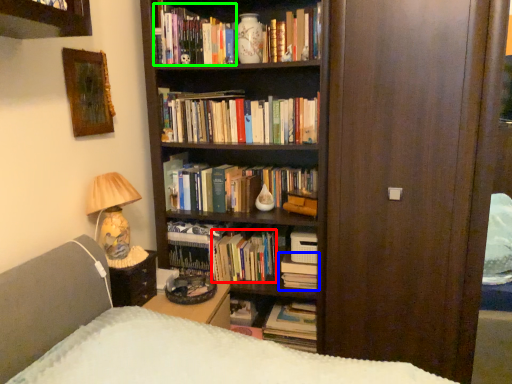
Question: Which object is positioned farthest from book (highlighted by a red box)? Select from book (highlighted by a blue box) and book (highlighted by a green box).

Choices:
 (A) book
 (B) book

Answer: (B)